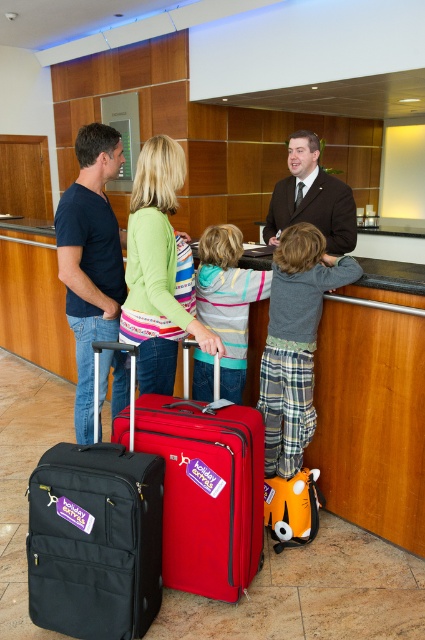
You are standing in the hotel lobby and need to place a new piece of furniture. The matte red suitcase at center is currently at point 0.769, 0.487. Where should you place the new furniture so it doesn not block the path to the suitcase?

The answer should state the coordinates or direction relative to the red suitcase to avoid blocking the path, using the Objects Description info.

You are a hotel porter carrying a 1.2 meter wide cart. You need to place the black fabric suitcase at lower left and the dark brown suit at center next to each other on the cart. Can both items fit side by side on the cart?

The black fabric suitcase at lower left is narrower than the dark brown suit at center. However, the combined width of both items would still need to be less than 1.2 meters to fit on the cart. Since the exact widths aren